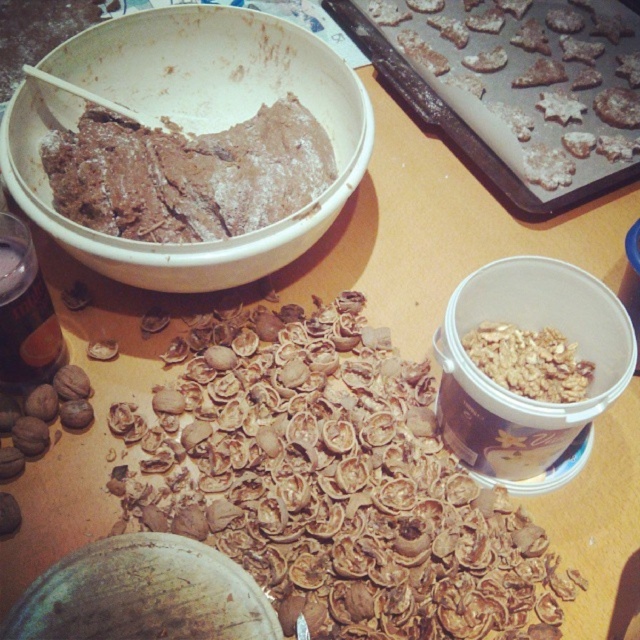
Between sugared cookie dough at upper right and chocolate dough at center, which one appears on the right side from the viewer's perspective?

sugared cookie dough at upper right

Does sugared cookie dough at upper right appear under chocolate dough at center?

Incorrect, sugared cookie dough at upper right is not positioned below chocolate dough at center.

Is point (572, 109) positioned after point (296, 134)?

Yes, it is behind point (296, 134).

At what (x,y) coordinates should I click in order to perform the action: click on sugared cookie dough at upper right. Please return your answer as a coordinate pair (x, y). Looking at the image, I should click on (529, 80).

Does brown matte bowl at upper left appear under chocolate dough at center?

Incorrect, brown matte bowl at upper left is not positioned below chocolate dough at center.

Does brown matte bowl at upper left have a greater width compared to chocolate dough at center?

Yes.

Who is more forward, (x=220, y=6) or (x=124, y=214)?

Positioned in front is point (x=124, y=214).

At what (x,y) coordinates should I click in order to perform the action: click on brown matte bowl at upper left. Please return your answer as a coordinate pair (x, y). The width and height of the screenshot is (640, 640). Looking at the image, I should click on (188, 125).

Does brown textured walnut shells at center lie in front of brown matte bowl at upper left?

Yes, brown textured walnut shells at center is closer to the viewer.

Can you confirm if brown textured walnut shells at center is positioned above brown matte bowl at upper left?

Incorrect, brown textured walnut shells at center is not positioned above brown matte bowl at upper left.

The image size is (640, 640). What do you see at coordinates (332, 483) in the screenshot?
I see `brown textured walnut shells at center` at bounding box center [332, 483].

Image resolution: width=640 pixels, height=640 pixels. I want to click on brown textured walnut shells at center, so click(332, 483).